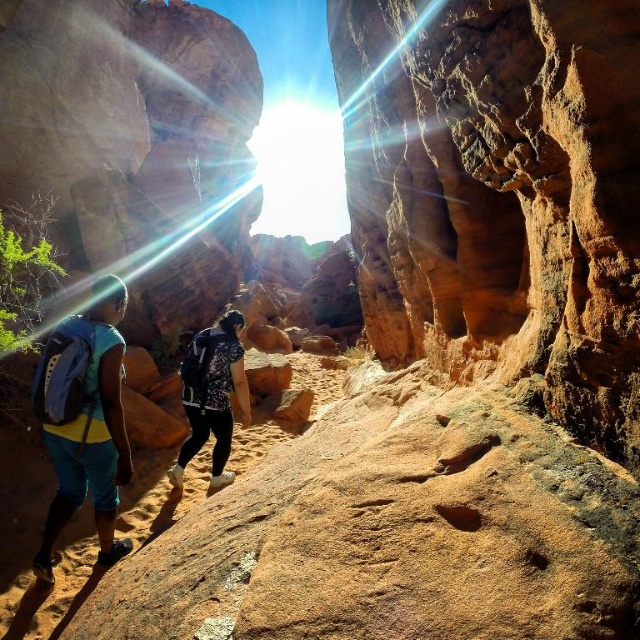
Can you confirm if blue fabric backpack at left is wider than floral-patterned shirt at center?

Incorrect, blue fabric backpack at left's width does not surpass floral-patterned shirt at center's.

Find the location of a particular element. This screenshot has width=640, height=640. blue fabric backpack at left is located at coordinates (84, 420).

Which is below, rustic sandstone arch at center or floral-patterned shirt at center?

Positioned lower is floral-patterned shirt at center.

Is point (531, 248) behind point (198, 403)?

No.

Image resolution: width=640 pixels, height=640 pixels. In order to click on rustic sandstone arch at center in this screenshot , I will do `click(499, 193)`.

Does rustic sandstone arch at center have a lesser width compared to blue fabric backpack at left?

Incorrect, rustic sandstone arch at center's width is not less than blue fabric backpack at left's.

Who is more distant from viewer, (385, 0) or (64, 460)?

Positioned behind is point (385, 0).

What do you see at coordinates (499, 193) in the screenshot? I see `rustic sandstone arch at center` at bounding box center [499, 193].

In order to click on rustic sandstone arch at center in this screenshot , I will do `click(499, 193)`.